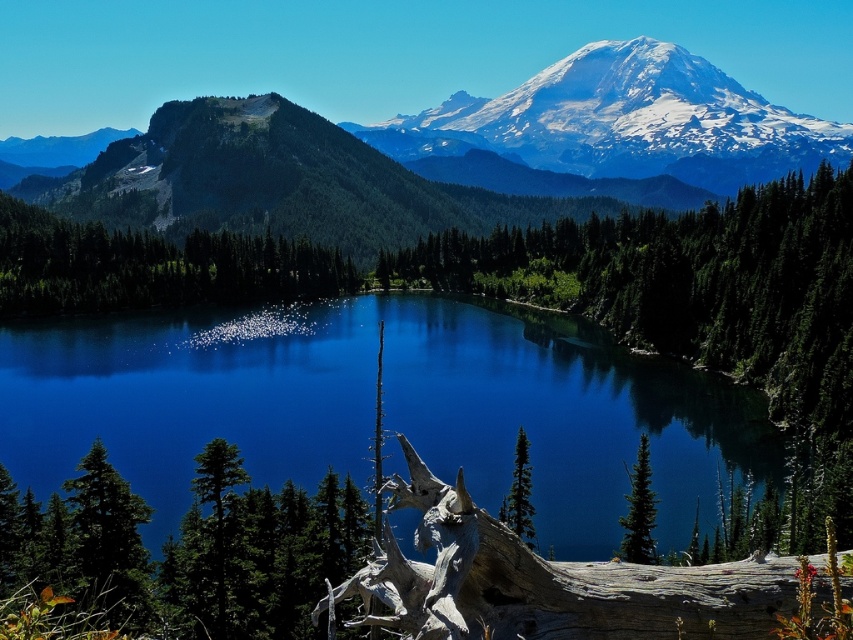
You are standing at the edge of the lake and see two points marked in the scene. Which point, point (x=643, y=531) or point (x=525, y=504), is closer to you?

Point (x=643, y=531) is closer to you because it is in front of point (x=525, y=504).